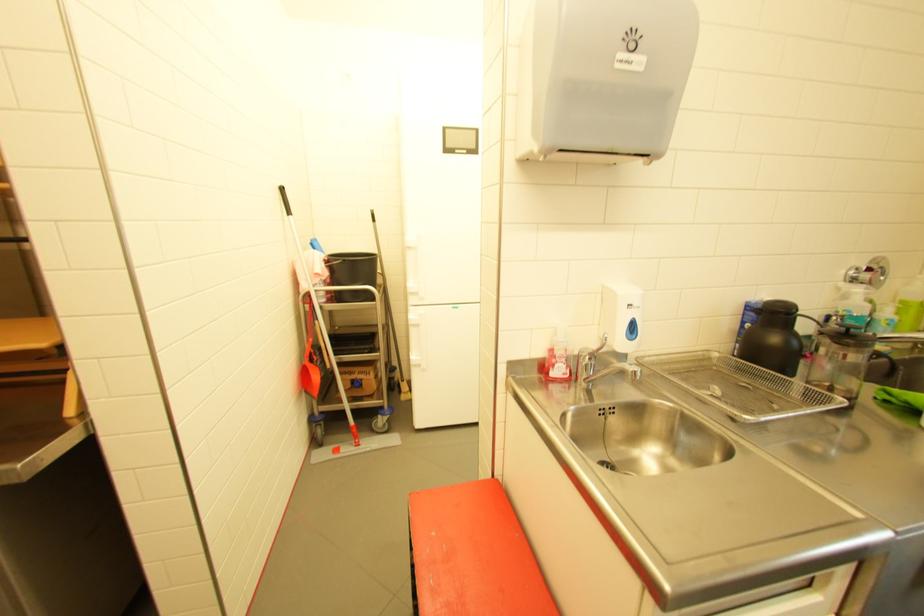
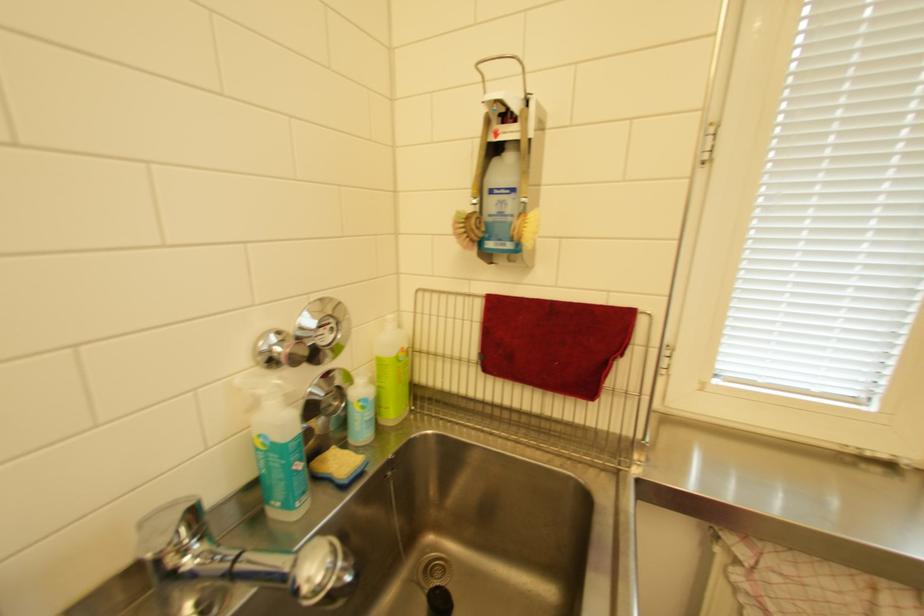
In the second image, find the point that corresponds to pixel 894 320 in the first image.

(367, 400)